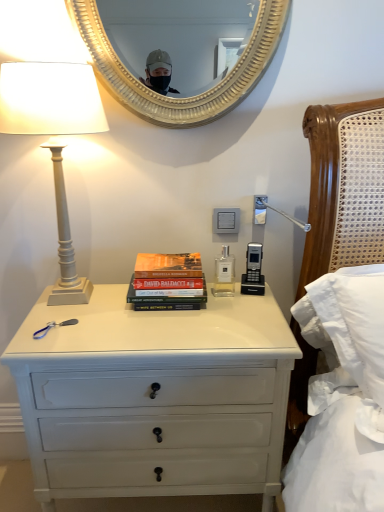
Locate an element on the screen. unoccupied region to the right of hardcover books at center is located at coordinates coord(241,308).